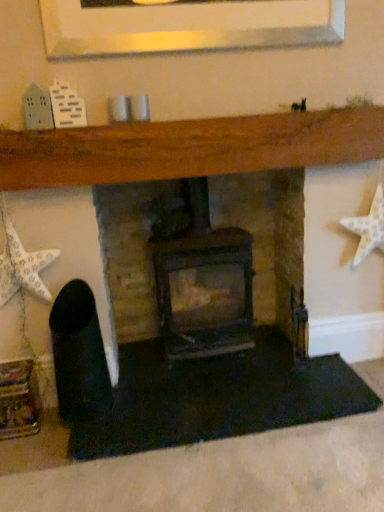
Question: Is white paper star at left, which appears as the second starfish when viewed from the right, beside dark brown wood burning stove at center?

Choices:
 (A) no
 (B) yes

Answer: (A)

Question: Is white paper star at left, which appears as the second starfish when viewed from the right, to the left of dark brown wood burning stove at center from the viewer's perspective?

Choices:
 (A) no
 (B) yes

Answer: (B)

Question: Is white paper star at left, which appears as the second starfish when viewed from the right, facing towards dark brown wood burning stove at center?

Choices:
 (A) no
 (B) yes

Answer: (A)

Question: Considering the relative positions of white paper star at left, which appears as the second starfish when viewed from the right, and dark brown wood burning stove at center in the image provided, is white paper star at left, which appears as the second starfish when viewed from the right, to the right of dark brown wood burning stove at center from the viewer's perspective?

Choices:
 (A) no
 (B) yes

Answer: (A)

Question: Can you confirm if white paper star at left, which appears as the second starfish when viewed from the right, is shorter than dark brown wood burning stove at center?

Choices:
 (A) yes
 (B) no

Answer: (A)

Question: Is white paper star at left, which appears as the second starfish when viewed from the right, in front of dark brown wood burning stove at center?

Choices:
 (A) yes
 (B) no

Answer: (A)

Question: Is rustic stone fireplace at center outside white matte starfish at right, the 2th starfish positioned from the left?

Choices:
 (A) no
 (B) yes

Answer: (B)

Question: Could you tell me if rustic stone fireplace at center is turned towards white matte starfish at right, the 1th starfish from the right?

Choices:
 (A) yes
 (B) no

Answer: (A)

Question: Does rustic stone fireplace at center have a lesser width compared to white matte starfish at right, the 2th starfish positioned from the left?

Choices:
 (A) yes
 (B) no

Answer: (A)

Question: Does rustic stone fireplace at center have a smaller size compared to white matte starfish at right, the 1th starfish from the right?

Choices:
 (A) yes
 (B) no

Answer: (B)

Question: From a real-world perspective, is rustic stone fireplace at center under white matte starfish at right, the 1th starfish from the right?

Choices:
 (A) yes
 (B) no

Answer: (A)

Question: From the image's perspective, is rustic stone fireplace at center on top of white matte starfish at right, the 2th starfish positioned from the left?

Choices:
 (A) no
 (B) yes

Answer: (A)

Question: Is white matte starfish at right, the 2th starfish positioned from the left, oriented away from white paper star at left, which appears as the second starfish when viewed from the right?

Choices:
 (A) yes
 (B) no

Answer: (B)